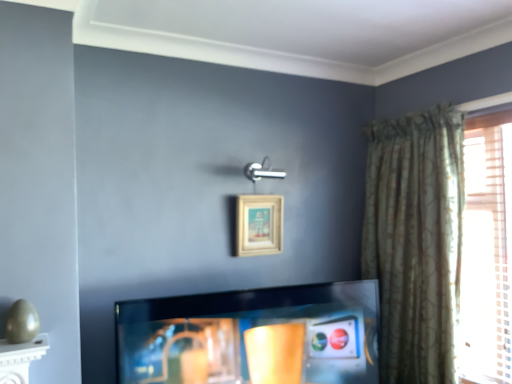
Question: Is beige wooden picture frame at upper center facing away from green textured curtain at right?

Choices:
 (A) yes
 (B) no

Answer: (B)

Question: Is beige wooden picture frame at upper center placed right next to green textured curtain at right?

Choices:
 (A) yes
 (B) no

Answer: (B)

Question: Is beige wooden picture frame at upper center in front of green textured curtain at right?

Choices:
 (A) no
 (B) yes

Answer: (A)

Question: Does beige wooden picture frame at upper center have a greater height compared to green textured curtain at right?

Choices:
 (A) yes
 (B) no

Answer: (B)

Question: Considering the relative sizes of beige wooden picture frame at upper center and green textured curtain at right in the image provided, is beige wooden picture frame at upper center smaller than green textured curtain at right?

Choices:
 (A) no
 (B) yes

Answer: (B)

Question: From the image's perspective, is beige wooden picture frame at upper center under green textured curtain at right?

Choices:
 (A) yes
 (B) no

Answer: (B)

Question: Considering the relative positions of shiny black tv at center and green textured curtain at right in the image provided, is shiny black tv at center behind green textured curtain at right?

Choices:
 (A) yes
 (B) no

Answer: (B)

Question: Is shiny black tv at center bigger than green textured curtain at right?

Choices:
 (A) yes
 (B) no

Answer: (B)

Question: From a real-world perspective, is shiny black tv at center positioned over green textured curtain at right based on gravity?

Choices:
 (A) yes
 (B) no

Answer: (B)

Question: From the image's perspective, is shiny black tv at center beneath green textured curtain at right?

Choices:
 (A) no
 (B) yes

Answer: (B)

Question: Considering the relative sizes of shiny black tv at center and green textured curtain at right in the image provided, is shiny black tv at center smaller than green textured curtain at right?

Choices:
 (A) no
 (B) yes

Answer: (B)

Question: Could you tell me if shiny black tv at center is turned towards green textured curtain at right?

Choices:
 (A) yes
 (B) no

Answer: (B)

Question: Is green textured curtain at right to the left of shiny black tv at center from the viewer's perspective?

Choices:
 (A) no
 (B) yes

Answer: (A)